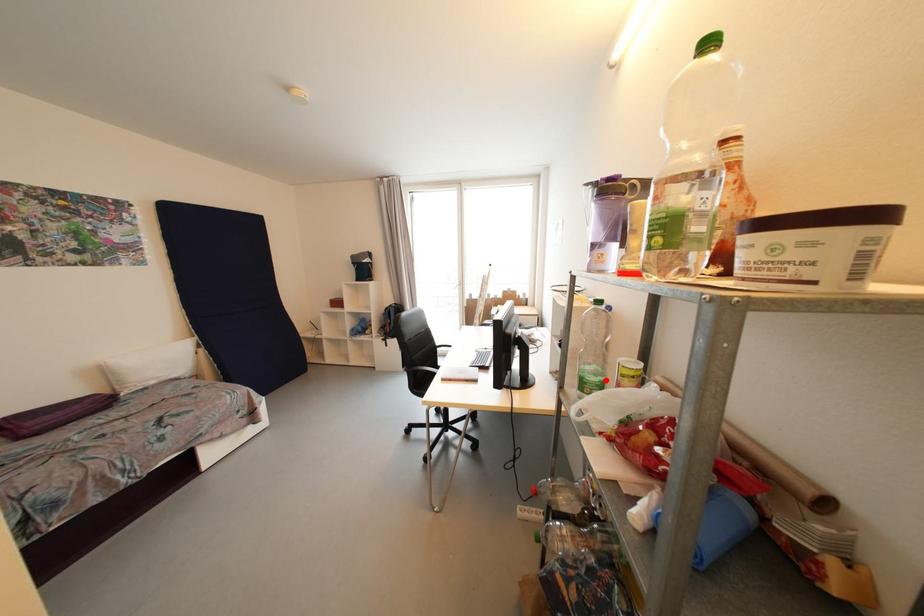
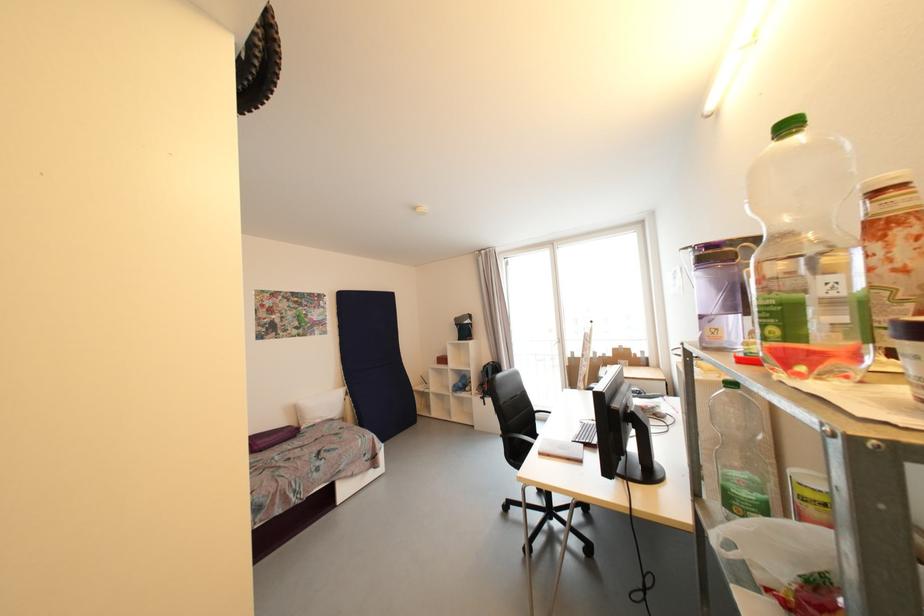
In the second image, find the point that corresponds to the highlighted location in the first image.

(763, 498)